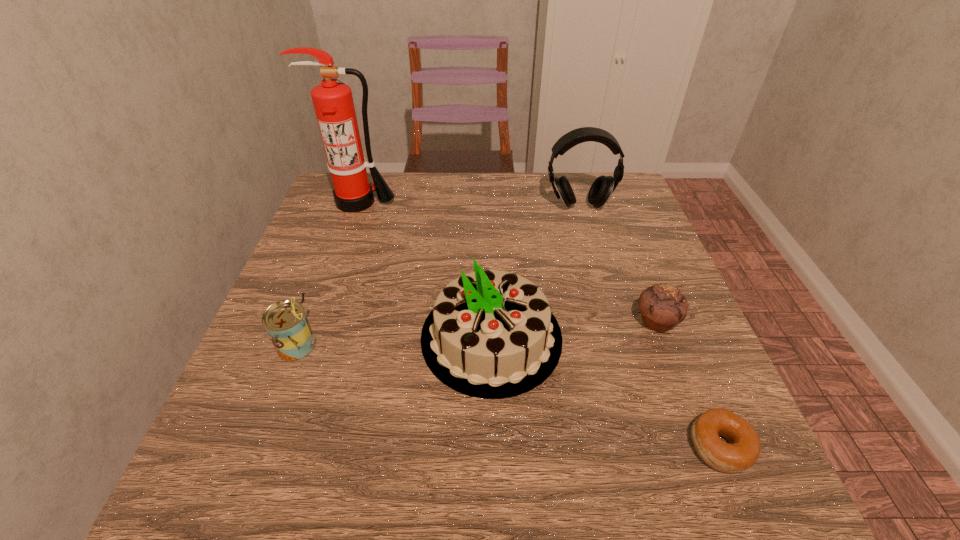
The width and height of the screenshot is (960, 540). In order to click on blank space at the far right corner in this screenshot , I will do `click(628, 211)`.

Identify the location of blank region between the muffin and the third tallest object. (574, 329).

Identify the location of empty location between the tallest object and the second shortest object. (508, 261).

This screenshot has height=540, width=960. I want to click on vacant area that lies between the birthday cake and the fire extinguisher, so click(x=425, y=269).

Identify the location of free space that is in between the fifth tallest object and the shortest object. The image size is (960, 540). (688, 383).

This screenshot has height=540, width=960. What are the coordinates of `empty space that is in between the third tallest object and the nearest object` in the screenshot? It's located at (606, 392).

Where is `empty location between the third tallest object and the tallest object`? empty location between the third tallest object and the tallest object is located at coordinates (425, 269).

Identify the location of free spot between the third shortest object and the earphone. (438, 276).

This screenshot has width=960, height=540. I want to click on free spot between the fire extinguisher and the earphone, so click(468, 204).

What are the coordinates of `empty space that is in between the earphone and the fourth shortest object` in the screenshot? It's located at (535, 272).